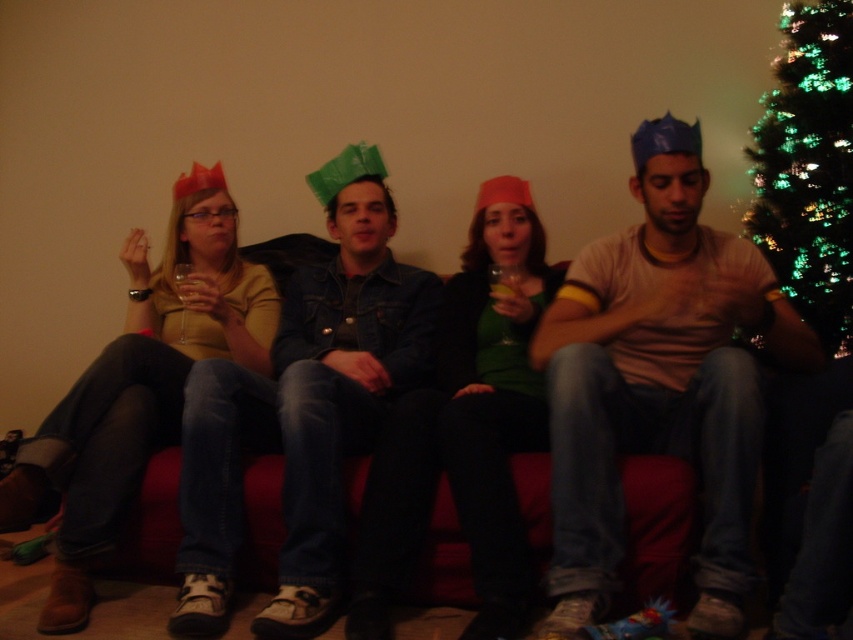
Is point (368, 292) farther from camera compared to point (842, 189)?

Yes, it is behind point (842, 189).

Is point (386, 172) closer to viewer compared to point (814, 198)?

That is False.

Where is `denim jacket at center`? The image size is (853, 640). denim jacket at center is located at coordinates (303, 410).

How much distance is there between matte brown shirt at center and denim jacket at center?

The distance of matte brown shirt at center from denim jacket at center is 65.27 centimeters.

Does matte brown shirt at center have a lesser height compared to denim jacket at center?

Yes.

In order to click on matte brown shirt at center in this screenshot , I will do tap(659, 380).

This screenshot has width=853, height=640. In order to click on matte brown shirt at center in this screenshot , I will do 659,380.

Is matte brown shirt at center below green glittering lights at upper right?

Indeed, matte brown shirt at center is positioned under green glittering lights at upper right.

Is matte brown shirt at center in front of green glittering lights at upper right?

Yes, matte brown shirt at center is closer to the viewer.

Between point (705, 388) and point (836, 33), which one is positioned in front?

Point (705, 388) is in front.

Find the location of a particular element. This screenshot has width=853, height=640. matte brown shirt at center is located at coordinates (659, 380).